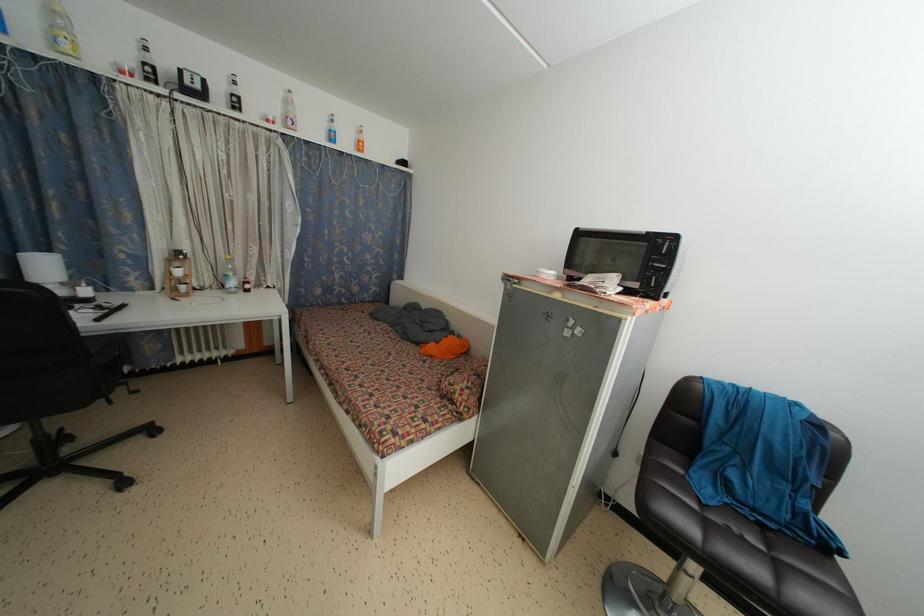
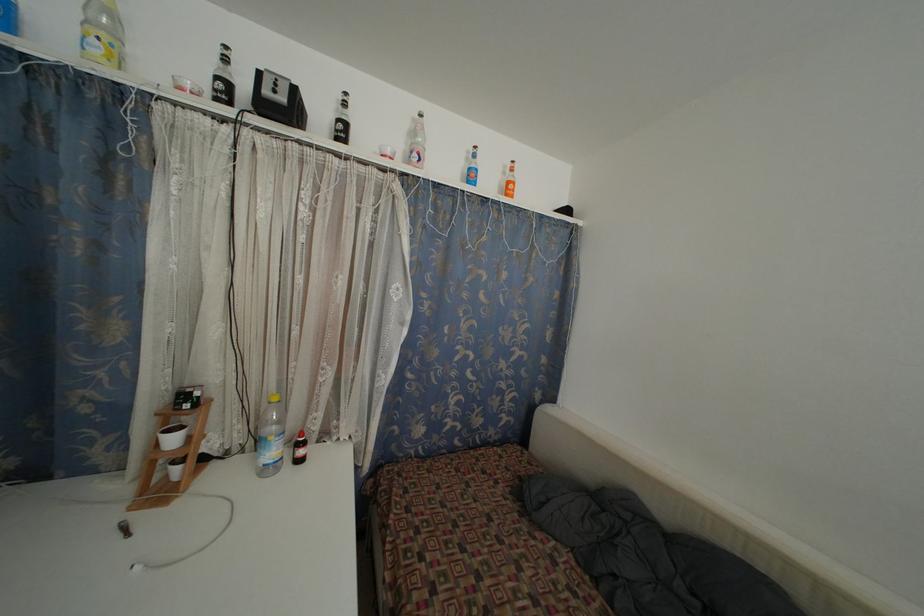
Locate, in the second image, the point that corresponds to point 202,92 in the first image.

(286, 105)